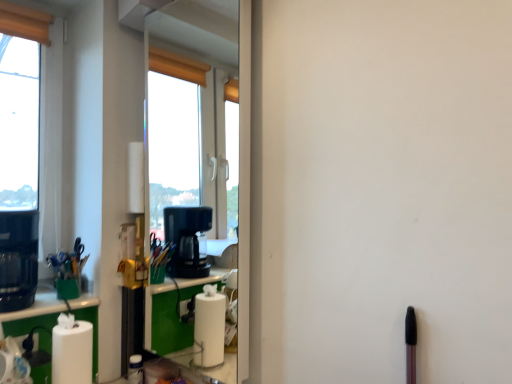
Question: Can you confirm if black plastic coffee machine at left is bigger than green matte cup at left?

Choices:
 (A) no
 (B) yes

Answer: (B)

Question: Is black plastic coffee machine at left oriented towards green matte cup at left?

Choices:
 (A) yes
 (B) no

Answer: (B)

Question: Is black plastic coffee machine at left in contact with green matte cup at left?

Choices:
 (A) yes
 (B) no

Answer: (B)

Question: From the image's perspective, does black plastic coffee machine at left appear higher than green matte cup at left?

Choices:
 (A) no
 (B) yes

Answer: (B)

Question: Is the depth of black plastic coffee machine at left greater than that of green matte cup at left?

Choices:
 (A) no
 (B) yes

Answer: (A)

Question: Is white matte window at left inside or outside of black plastic coffee machine at left?

Choices:
 (A) outside
 (B) inside

Answer: (A)

Question: From a real-world perspective, is white matte window at left positioned above or below black plastic coffee machine at left?

Choices:
 (A) below
 (B) above

Answer: (B)

Question: In terms of height, does white matte window at left look taller or shorter compared to black plastic coffee machine at left?

Choices:
 (A) tall
 (B) short

Answer: (A)

Question: From the image's perspective, is white matte window at left located above or below black plastic coffee machine at left?

Choices:
 (A) above
 (B) below

Answer: (A)

Question: Do you think white matte window at left is within green matte cup at left, or outside of it?

Choices:
 (A) outside
 (B) inside

Answer: (A)

Question: Is point click(15, 279) closer or farther from the camera than point click(61, 284)?

Choices:
 (A) closer
 (B) farther

Answer: (A)

Question: Visually, is white matte window at left positioned to the left or to the right of green matte cup at left?

Choices:
 (A) right
 (B) left

Answer: (B)

Question: Is white matte window at left in front of or behind green matte cup at left in the image?

Choices:
 (A) front
 (B) behind

Answer: (B)

Question: From the image's perspective, is white matte paper towel at lower left above or below black plastic coffee machine at left?

Choices:
 (A) below
 (B) above

Answer: (A)

Question: In the image, is white matte paper towel at lower left positioned in front of or behind black plastic coffee machine at left?

Choices:
 (A) front
 (B) behind

Answer: (A)